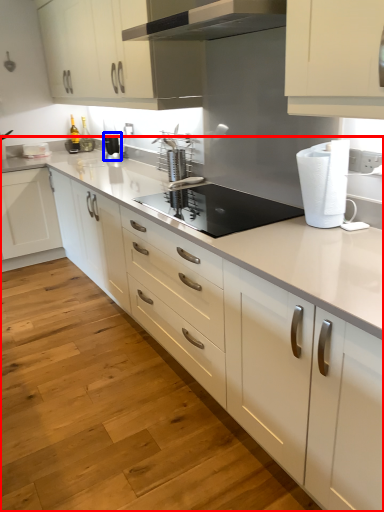
Question: Which object appears closest to the camera in this image, countertop (highlighted by a red box) or kitchen appliance (highlighted by a blue box)?

Choices:
 (A) countertop
 (B) kitchen appliance

Answer: (A)